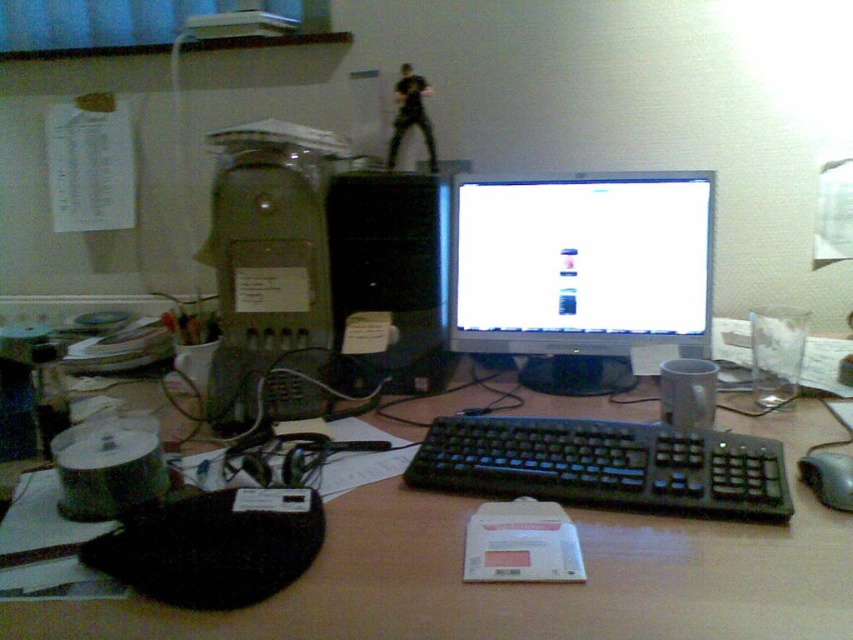
Question: Based on their relative distances, which object is nearer to the matte gray desktop computer at center?

Choices:
 (A) black plastic computer tower at center
 (B) white glossy monitor at center
 (C) black plastic keyboard at center
 (D) brown wooden desk at center

Answer: (A)

Question: Observing the image, what is the correct spatial positioning of matte gray desktop computer at center in reference to black plastic keyboard at center?

Choices:
 (A) left
 (B) right

Answer: (A)

Question: Which of the following is the farthest from the observer?

Choices:
 (A) matte gray desktop computer at center
 (B) black plastic keyboard at center

Answer: (A)

Question: Is matte gray desktop computer at center behind black plastic computer tower at center?

Choices:
 (A) yes
 (B) no

Answer: (B)

Question: Which point is closer to the camera?

Choices:
 (A) (289, 396)
 (B) (389, 236)

Answer: (A)

Question: Is brown wooden desk at center in front of matte gray desktop computer at center?

Choices:
 (A) yes
 (B) no

Answer: (A)